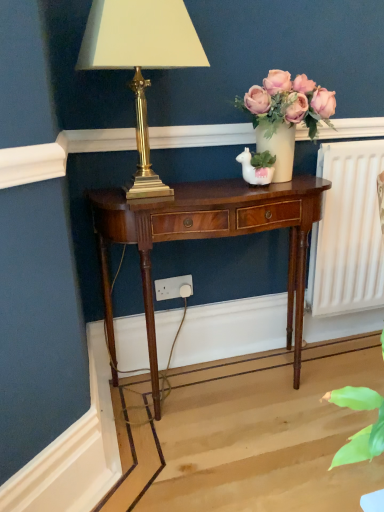
Question: Is gold brass lamp at upper left wider or thinner than mahogany wood nightstand at center?

Choices:
 (A) thin
 (B) wide

Answer: (A)

Question: From a real-world perspective, is gold brass lamp at upper left physically located above or below mahogany wood nightstand at center?

Choices:
 (A) below
 (B) above

Answer: (B)

Question: Estimate the real-world distances between objects in this image. Which object is farther from the matte white vase at upper right?

Choices:
 (A) white plastic power outlet at lower center
 (B) gold brass lamp at upper left
 (C) mahogany wood nightstand at center

Answer: (A)

Question: Which of these objects is positioned closest to the mahogany wood nightstand at center?

Choices:
 (A) matte white vase at upper right
 (B) gold brass lamp at upper left
 (C) white plastic power outlet at lower center

Answer: (A)